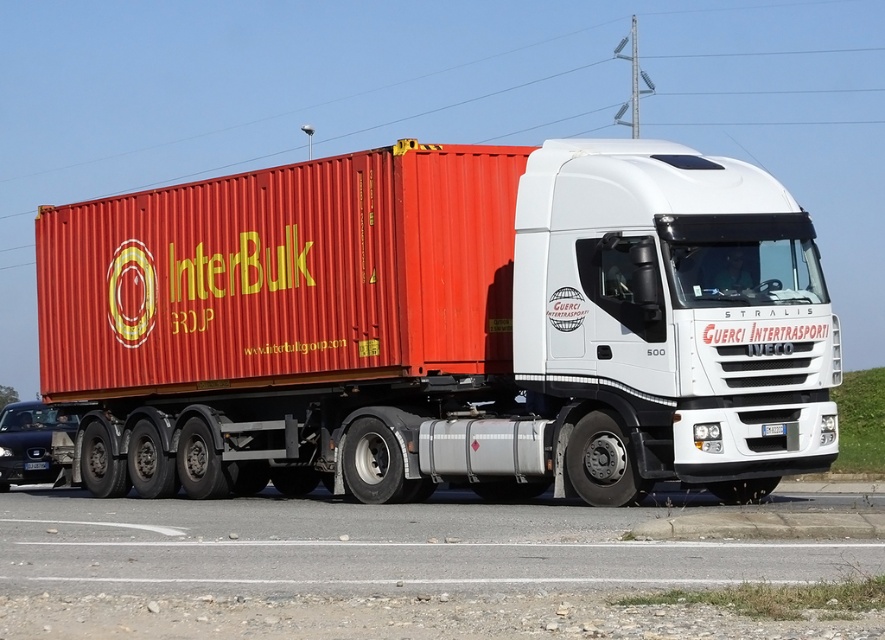
Between metallic red shipping container at center and white plastic license plate at center, which one has less height?

With less height is white plastic license plate at center.

Does point (386, 337) lie in front of point (772, 432)?

No, it is not.

I want to click on metallic red shipping container at center, so click(283, 275).

Which is below, metallic blue sedan at lower left or white plastic license plate at center?

Positioned lower is metallic blue sedan at lower left.

What are the coordinates of `metallic blue sedan at lower left` in the screenshot? It's located at (29, 442).

At what (x,y) coordinates should I click in order to perform the action: click on metallic blue sedan at lower left. Please return your answer as a coordinate pair (x, y). The width and height of the screenshot is (885, 640). Looking at the image, I should click on (29, 442).

The width and height of the screenshot is (885, 640). I want to click on metallic red container at center, so click(x=443, y=326).

Is point (668, 458) behind point (2, 419)?

No, it is not.

Find the location of a particular element. This screenshot has height=640, width=885. metallic red container at center is located at coordinates (443, 326).

You are a GUI agent. You are given a task and a screenshot of the screen. Output one action in this format:
    pyautogui.click(x=<x>, y=<y>)
    Task: Click on the metallic red container at center
    The image size is (885, 640).
    Given the screenshot: What is the action you would take?
    [443, 326]